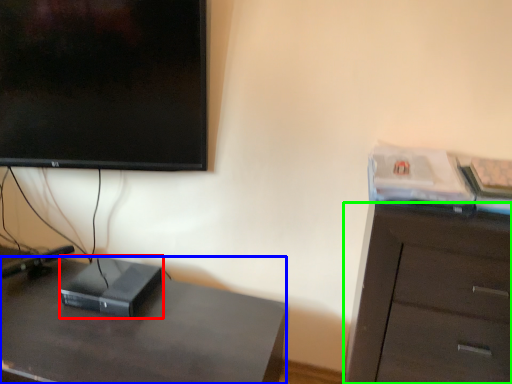
Question: Which object is the farthest from computer (highlighted by a red box)? Choose among these: desk (highlighted by a blue box) or cabinetry (highlighted by a green box).

Choices:
 (A) desk
 (B) cabinetry

Answer: (B)